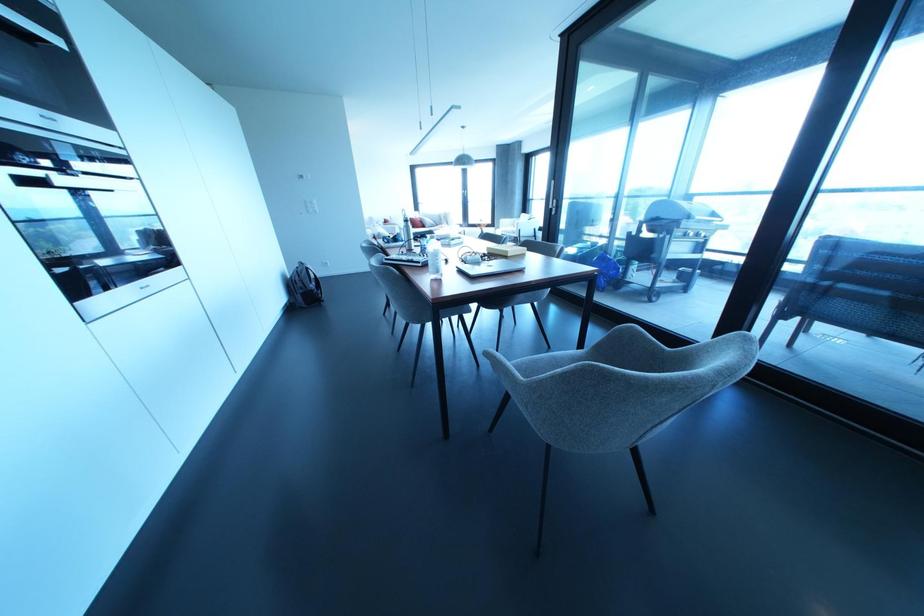
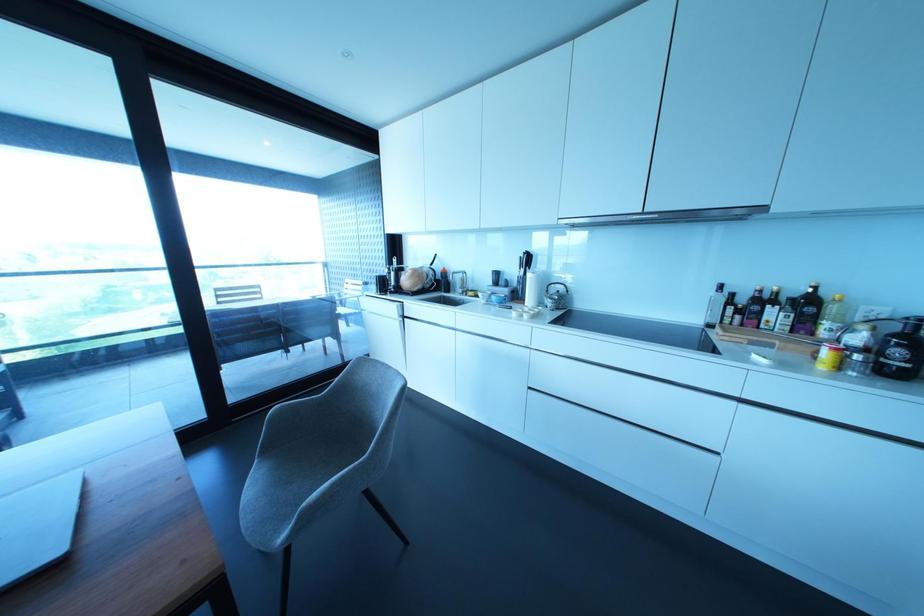
In the second image, find the point that corresponds to [630,326] in the first image.

(282, 407)